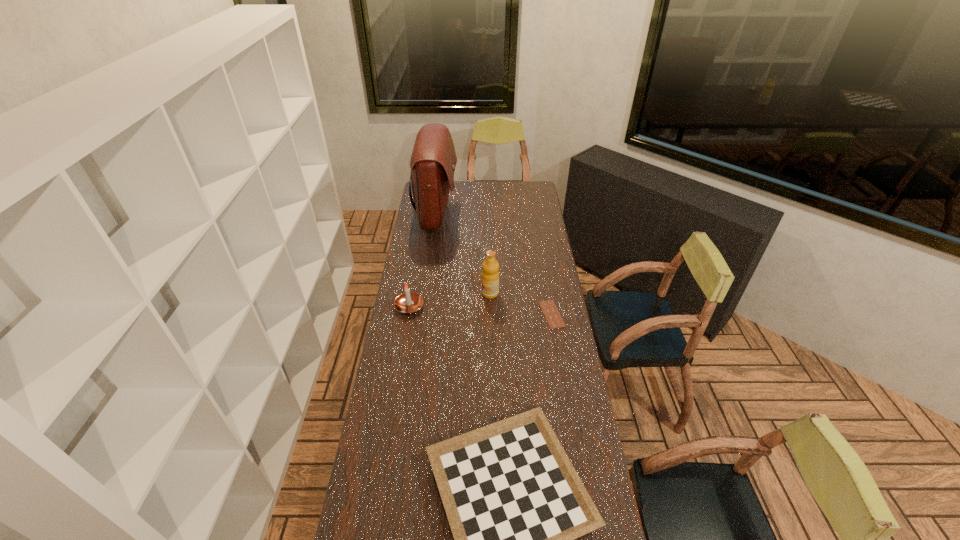
Identify the location of free spot between the fruit juice and the chocolate bar. The height and width of the screenshot is (540, 960). [x=521, y=304].

At what (x,y) coordinates should I click in order to perform the action: click on vacant area between the second tallest object and the farthest object. Please return your answer as a coordinate pair (x, y). The width and height of the screenshot is (960, 540). Looking at the image, I should click on (464, 254).

I want to click on free point between the third tallest object and the chocolate bar, so click(480, 310).

Identify which object is the fourth closest to the checkerboard. Please provide its 2D coordinates. Your answer should be formatted as a tuple, i.e. [(x, y)], where the tuple contains the x and y coordinates of a point satisfying the conditions above.

[(433, 160)]

Locate an element on the screen. the third closest object to the shortest object is located at coordinates (408, 302).

At what (x,y) coordinates should I click in order to perform the action: click on vacant space that satisfies the following two spatial constraints: 1. on the open flap of the shortest object; 2. on the left side of the farthest object. Please return your answer as a coordinate pair (x, y). Looking at the image, I should click on (423, 314).

At what (x,y) coordinates should I click in order to perform the action: click on vacant space that satisfies the following two spatial constraints: 1. on the open flap of the tallest object; 2. on the right side of the shortest object. Please return your answer as a coordinate pair (x, y). Looking at the image, I should click on (423, 314).

At what (x,y) coordinates should I click in order to perform the action: click on free spot that satisfies the following two spatial constraints: 1. on the back side of the shortest object; 2. on the front label of the fruit juice. Please return your answer as a coordinate pair (x, y). This screenshot has height=540, width=960. Looking at the image, I should click on (548, 293).

Where is `free location that satisfies the following two spatial constraints: 1. on the open flap of the satchel; 2. on the front side of the candle`? This screenshot has width=960, height=540. free location that satisfies the following two spatial constraints: 1. on the open flap of the satchel; 2. on the front side of the candle is located at coordinates (424, 306).